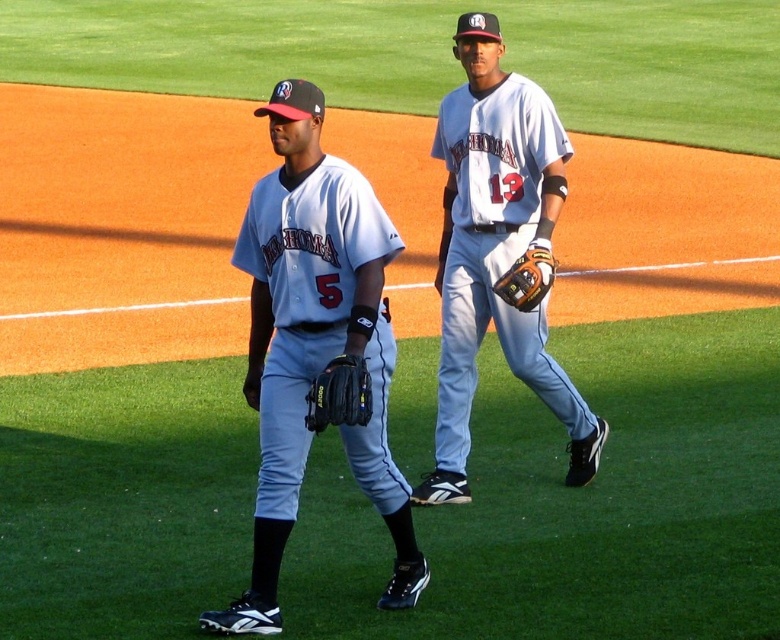
You are a baseball coach observing the field. You notice the white matte baseball glove at center and the black leather baseball glove at lower center. Which glove is placed higher in the image?

The white matte baseball glove at center is positioned over the black leather baseball glove at lower center, meaning it is higher in the image.

You are a baseball coach observing the field. You notice a point at coordinates (339,394). What object is located at that point?

The point at coordinates (339,394) corresponds to the black leather baseball glove at lower center.

You are a baseball coach observing the field. You notice the white matte baseball glove at center. Where exactly is it located in terms of coordinates?

The white matte baseball glove at center is located at coordinates point (495,252).